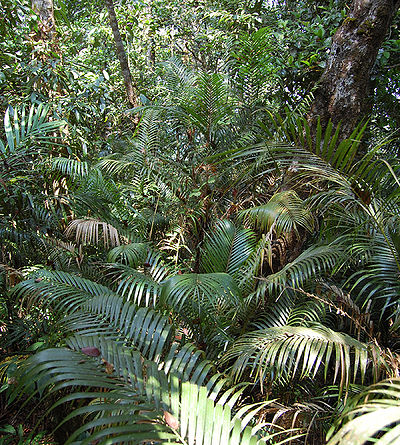
Image resolution: width=400 pixels, height=445 pixels. Find the location of `floor`. floor is located at coordinates (280, 431).